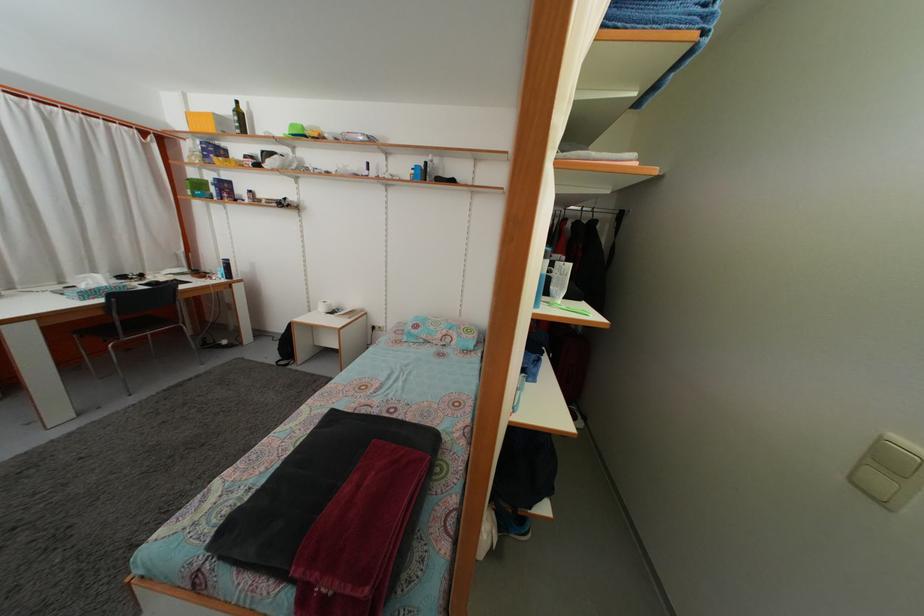
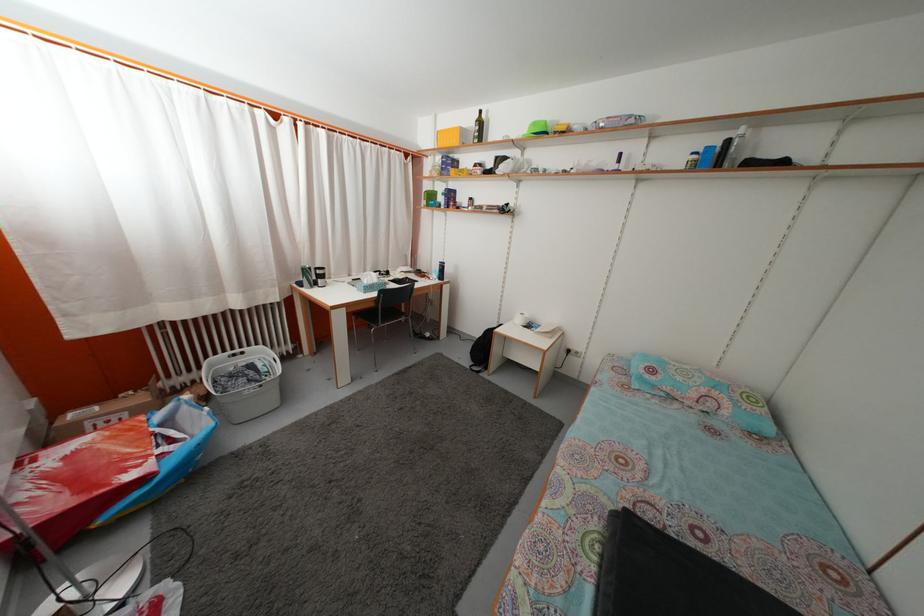
Question: The images are taken continuously from a first-person perspective. In which direction are you moving?

Choices:
 (A) Left
 (B) Right
 (C) Forward
 (D) Backward

Answer: (A)